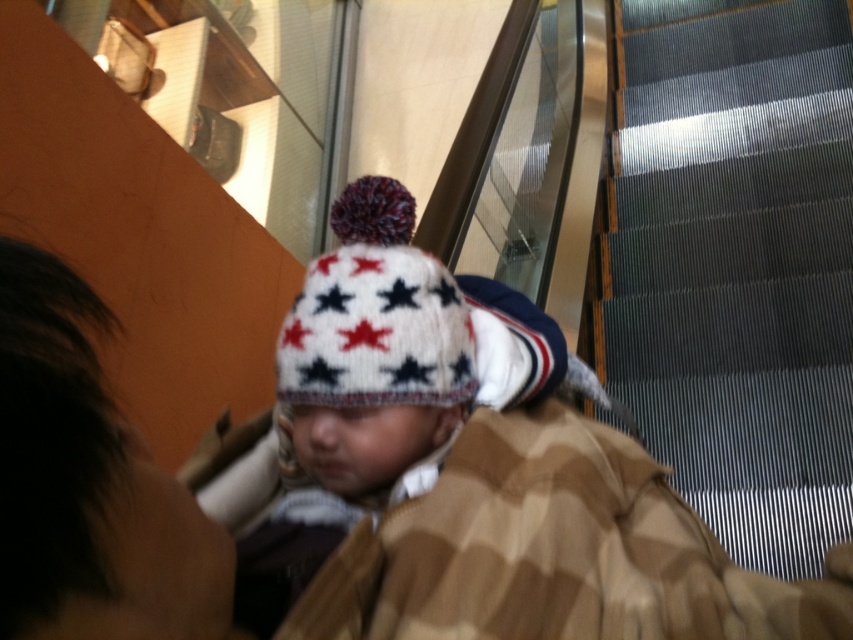
You are standing at the bottom of the escalator in the mall. You see a point labeled as point (734, 262). What object is located at that point?

The point (734, 262) indicates metallic gray stairs at right.

You are a photographer taking a picture of the scene. You want to focus on the white knitted hat at center and the metallic gray stairs at right. Which object should you adjust your camera focus on first if you want to ensure both are in focus?

You should focus on the white knitted hat at center first because it is closer to you than the metallic gray stairs at right, which is further away. By focusing on the closer object, the depth of field may naturally include the farther object in acceptable focus.

You are a photographer trying to capture the white knitted hat at center and the metallic gray stairs at right in the same frame. Based on their positions, which object should you focus on first to ensure both are in the shot?

The white knitted hat at center is at the center, so focus on it first to ensure both it and the metallic gray stairs at right, which are on the right side of the hat, are included in the frame.